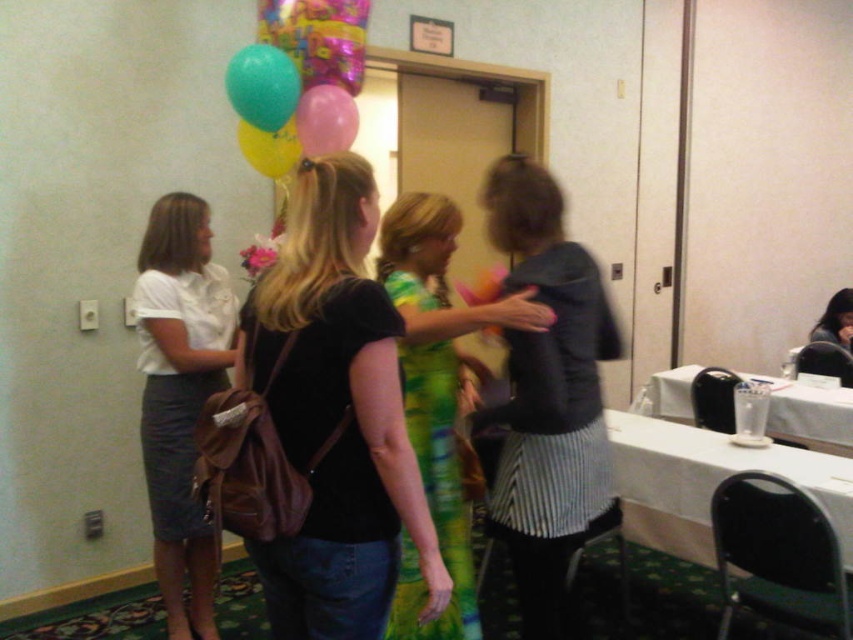
You are standing in the room and want to move from point (204, 550) to point (309, 99). Which direction should you face to walk towards the second point?

To move from point (204, 550) to point (309, 99), you should face towards the left direction since point (309, 99) is located to the left of point (204, 550).

You are holding a camera and want to take a photo of the translucent rubber balloon at upper left. If the camera has a minimum focus distance of 8 feet, will you be able to focus on the balloon?

The distance between the translucent rubber balloon at upper left and the camera is 7.96 feet, which is less than the minimum focus distance of 8 feet. Therefore, the camera cannot focus on the balloon.